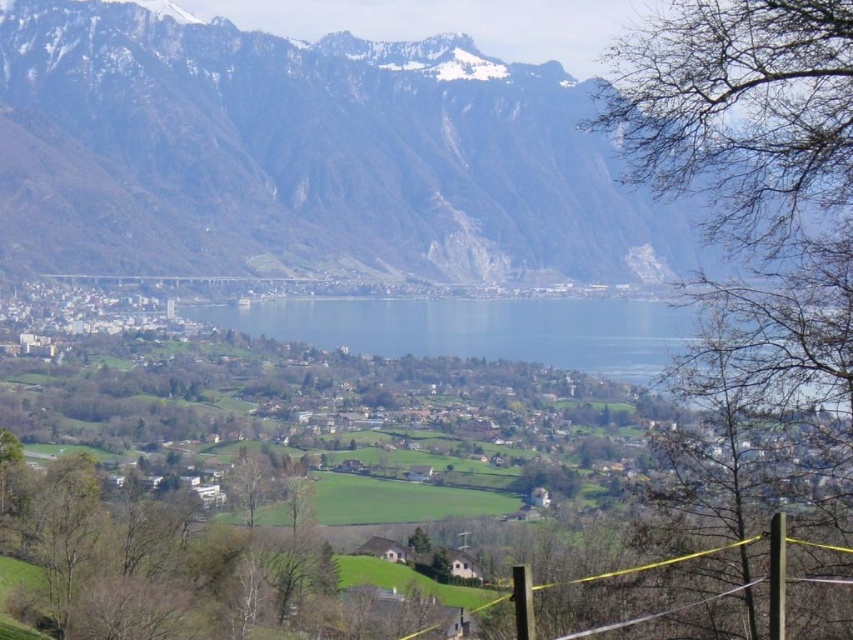
You are a hiker planning to take a photo of the rocky gray mountain at upper center from the yellow rope barrier in the bottom right corner. Based on the scene description, will the mountain be fully visible in your photo without any obstructions?

The rocky gray mountain at upper center is located at point (306, 156), which means it is positioned in the upper part of the image. Since the yellow rope barrier is at the bottom right corner, the mountain should be visible in the photo as there are no mentioned obstructions between them in the scene description.

You are standing at the yellow rope barrier in the bottom right corner of the valley scene. You see two points marked in the image, point [422,333] and point [729,545]. Which point is closer to your current position?

Point [422,333] is closer to your current position because it is further to the viewer than point [729,545].

From the picture: You are a hiker who wants to take a photo of the rocky gray mountain at upper center and the yellow string at lower right in the same frame. Based on their positions, which object should you place on the left side of your camera viewfinder to include both?

The rocky gray mountain at upper center should be placed on the left side of your camera viewfinder since it is to the left of the yellow string at lower right.